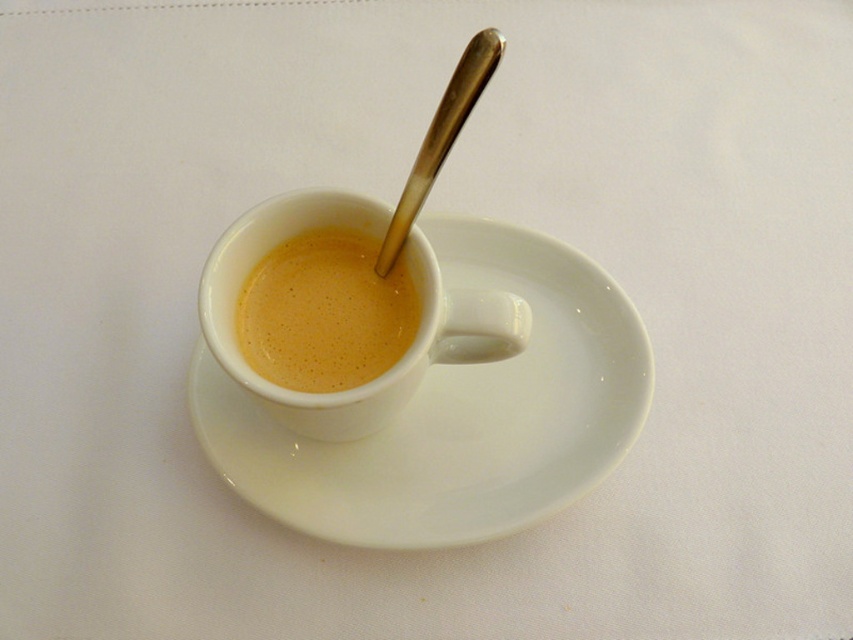
Between point (543, 364) and point (410, 257), which one is positioned behind?

The point (543, 364) is more distant.

Between white glossy saucer at center and white ceramic mug at center, which one has more height?

white glossy saucer at center

Locate an element on the screen. Image resolution: width=853 pixels, height=640 pixels. white glossy saucer at center is located at coordinates (457, 413).

Where is `white glossy saucer at center`? The width and height of the screenshot is (853, 640). white glossy saucer at center is located at coordinates (457, 413).

Which is in front, point (374, 236) or point (480, 67)?

Point (480, 67)

Can you confirm if white ceramic mug at center is positioned above polished metal spoon at upper center?

Incorrect, white ceramic mug at center is not positioned above polished metal spoon at upper center.

The width and height of the screenshot is (853, 640). Describe the element at coordinates (405, 349) in the screenshot. I see `white ceramic mug at center` at that location.

Where is `white ceramic mug at center`? The height and width of the screenshot is (640, 853). white ceramic mug at center is located at coordinates (405, 349).

Can you confirm if white glossy saucer at center is positioned above smooth cream cup at center?

Incorrect, white glossy saucer at center is not positioned above smooth cream cup at center.

Who is positioned more to the left, white glossy saucer at center or smooth cream cup at center?

smooth cream cup at center is more to the left.

I want to click on white glossy saucer at center, so tap(457, 413).